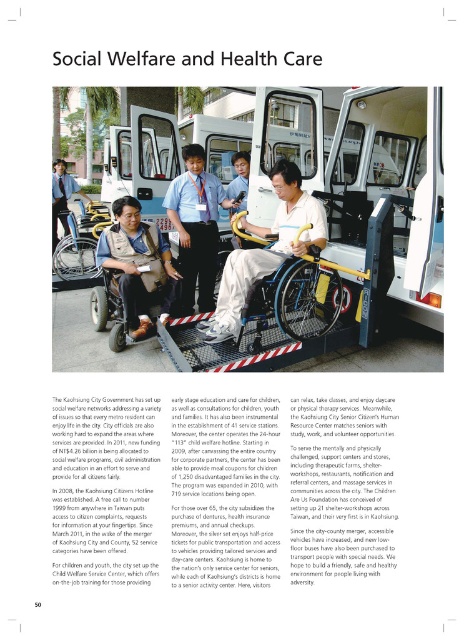
Question: Estimate the real-world distances between objects in this image. Which object is closer to the white plastic wheelchair at center?

Choices:
 (A) blue uniform shirt at center
 (B) blue metallic wheelchair at center
 (C) light brown leather jacket at center
 (D) matte black wheelchair at center

Answer: (A)

Question: Is blue uniform shirt at center to the right of blue metallic wheelchair at center from the viewer's perspective?

Choices:
 (A) yes
 (B) no

Answer: (B)

Question: Among these points, which one is farthest from the camera?

Choices:
 (A) (186, 230)
 (B) (437, 138)

Answer: (A)

Question: Is white plastic wheelchair at center bigger than light brown leather jacket at center?

Choices:
 (A) no
 (B) yes

Answer: (B)

Question: Which object is closer to the camera taking this photo?

Choices:
 (A) matte black wheelchair at center
 (B) blue uniform shirt at center
 (C) white plastic wheelchair at center
 (D) blue metallic wheelchair at center

Answer: (D)

Question: Where is white plastic wheelchair at center located in relation to matte black wheelchair at center in the image?

Choices:
 (A) left
 (B) right

Answer: (B)